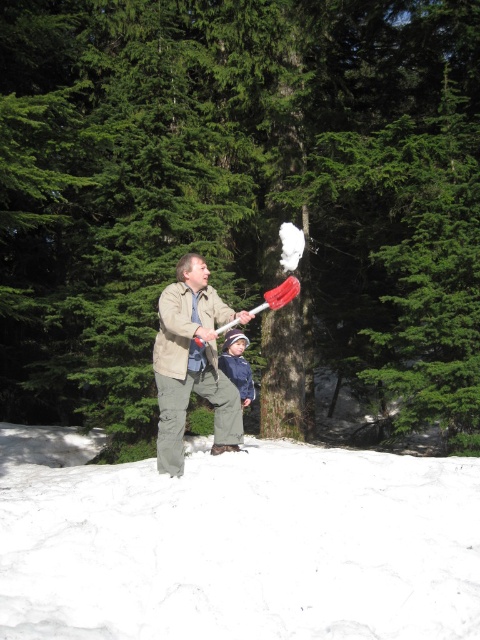
You are standing in the snowy forest and want to place a small gift box on the white fluffy snow at lower center. According to the scene description, where exactly should you place the gift box?

The white fluffy snow at lower center is located at point [236,544], so you should place the small gift box there.

You are a photographer trying to capture a photo of both the matte khaki jacket at center and the blue denim jacket at center in the same frame. Based on their positions, which jacket should you focus on first to ensure both are in the frame?

The matte khaki jacket at center is positioned on the left side of blue denim jacket at center, so you should focus on the blue denim jacket at center first to ensure both are in the frame.